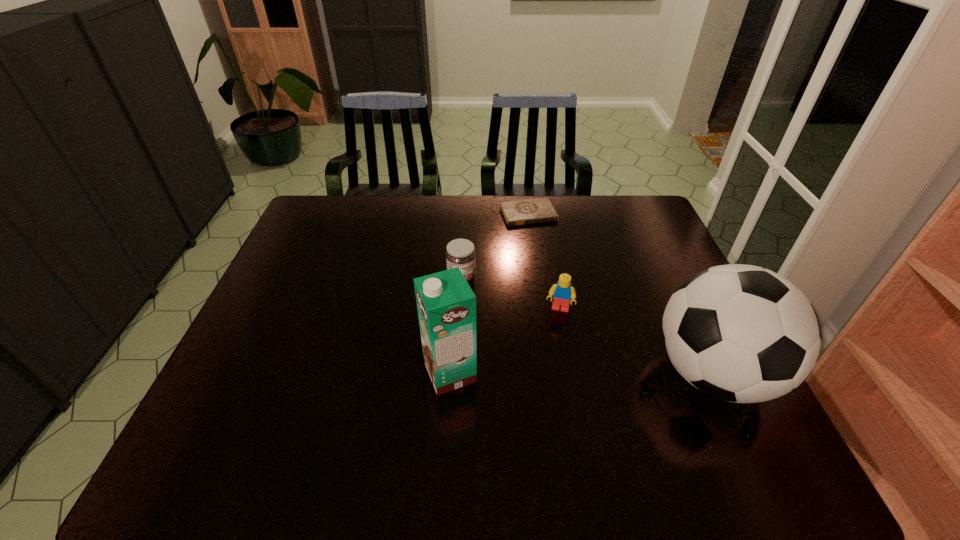
The height and width of the screenshot is (540, 960). I want to click on blank space located 0.110m on the front-facing side of the Lego, so click(x=552, y=348).

Image resolution: width=960 pixels, height=540 pixels. Identify the location of vacant space situated on the front label of the jam. (544, 336).

The height and width of the screenshot is (540, 960). I want to click on vacant space situated 0.180m on the front label of the jam, so click(518, 318).

Locate an element on the screen. The image size is (960, 540). vacant position located on the front label of the jam is located at coordinates (554, 343).

I want to click on free space located on the spine side of the shortest object, so click(542, 241).

The image size is (960, 540). I want to click on vacant space situated on the spine side of the shortest object, so click(562, 280).

Locate an element on the screen. Image resolution: width=960 pixels, height=540 pixels. free space located on the spine side of the shortest object is located at coordinates (543, 243).

Locate an element on the screen. object located in the far edge section of the desktop is located at coordinates (530, 211).

The height and width of the screenshot is (540, 960). I want to click on carton present at the near edge, so click(446, 304).

The image size is (960, 540). I want to click on soccer ball at the near edge, so click(x=741, y=333).